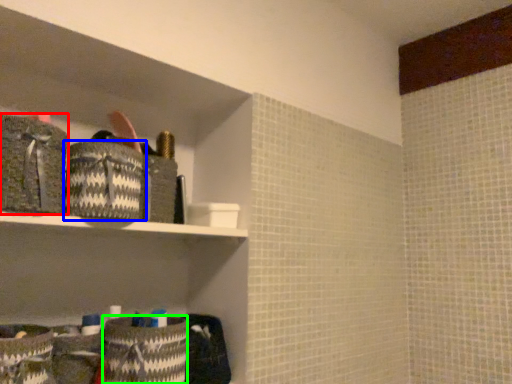
Question: Which object is positioned farthest from material (highlighted by a red box)? Select from material (highlighted by a blue box) and material (highlighted by a green box).

Choices:
 (A) material
 (B) material

Answer: (B)